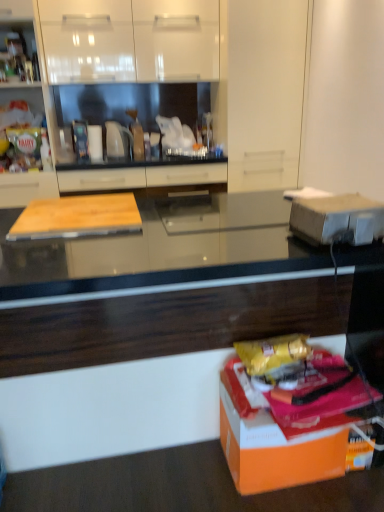
Question: Can you confirm if white glossy cabinet at upper center, the 2th cabinetry from the left, is smaller than black glossy countertop at center?

Choices:
 (A) yes
 (B) no

Answer: (A)

Question: Is white glossy cabinet at upper center, the second cabinetry from the right, not close to black glossy countertop at center?

Choices:
 (A) yes
 (B) no

Answer: (A)

Question: From the image's perspective, is white glossy cabinet at upper center, the second cabinetry from the right, below black glossy countertop at center?

Choices:
 (A) no
 (B) yes

Answer: (A)

Question: Is white glossy cabinet at upper center, the second cabinetry from the right, thinner than black glossy countertop at center?

Choices:
 (A) yes
 (B) no

Answer: (A)

Question: From a real-world perspective, is white glossy cabinet at upper center, the second cabinetry from the right, over black glossy countertop at center?

Choices:
 (A) yes
 (B) no

Answer: (A)

Question: Is wooden cutting board at left, the 3th cabinetry when ordered from right to left, in front of or behind white cardboard box at right, the second cardboard box in the bottom-to-top sequence, in the image?

Choices:
 (A) behind
 (B) front

Answer: (A)

Question: From a real-world perspective, is wooden cutting board at left, which ranks as the 1th cabinetry in left-to-right order, physically located above or below white cardboard box at right, the second cardboard box in the bottom-to-top sequence?

Choices:
 (A) below
 (B) above

Answer: (B)

Question: Considering the positions of point (24, 181) and point (360, 207), is point (24, 181) closer or farther from the camera than point (360, 207)?

Choices:
 (A) farther
 (B) closer

Answer: (A)

Question: In terms of size, does wooden cutting board at left, which ranks as the 1th cabinetry in left-to-right order, appear bigger or smaller than white cardboard box at right, the second cardboard box in the bottom-to-top sequence?

Choices:
 (A) small
 (B) big

Answer: (B)

Question: From the image's perspective, is matte wood cutting board at center, which is the third cabinetry from left to right, located above or below wooden cutting board at left, which ranks as the 1th cabinetry in left-to-right order?

Choices:
 (A) below
 (B) above

Answer: (A)

Question: In terms of size, does matte wood cutting board at center, the first cabinetry when ordered from right to left, appear bigger or smaller than wooden cutting board at left, the 3th cabinetry when ordered from right to left?

Choices:
 (A) big
 (B) small

Answer: (B)

Question: In terms of height, does matte wood cutting board at center, the first cabinetry when ordered from right to left, look taller or shorter compared to wooden cutting board at left, the 3th cabinetry when ordered from right to left?

Choices:
 (A) short
 (B) tall

Answer: (A)

Question: Is matte wood cutting board at center, the first cabinetry when ordered from right to left, wider or thinner than wooden cutting board at left, the 3th cabinetry when ordered from right to left?

Choices:
 (A) wide
 (B) thin

Answer: (B)

Question: From the image's perspective, is orange matte cardboard box at lower right, positioned as the 1th cardboard box in bottom-to-top order, above or below wooden cutting board at left, which ranks as the 1th cabinetry in left-to-right order?

Choices:
 (A) below
 (B) above

Answer: (A)

Question: Is point (264, 423) positioned closer to the camera than point (38, 193)?

Choices:
 (A) closer
 (B) farther

Answer: (A)